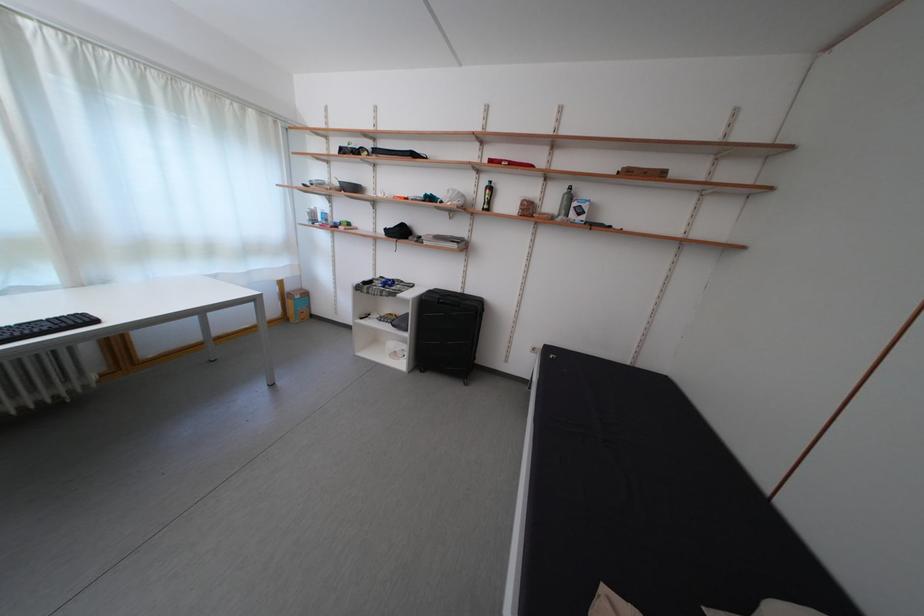
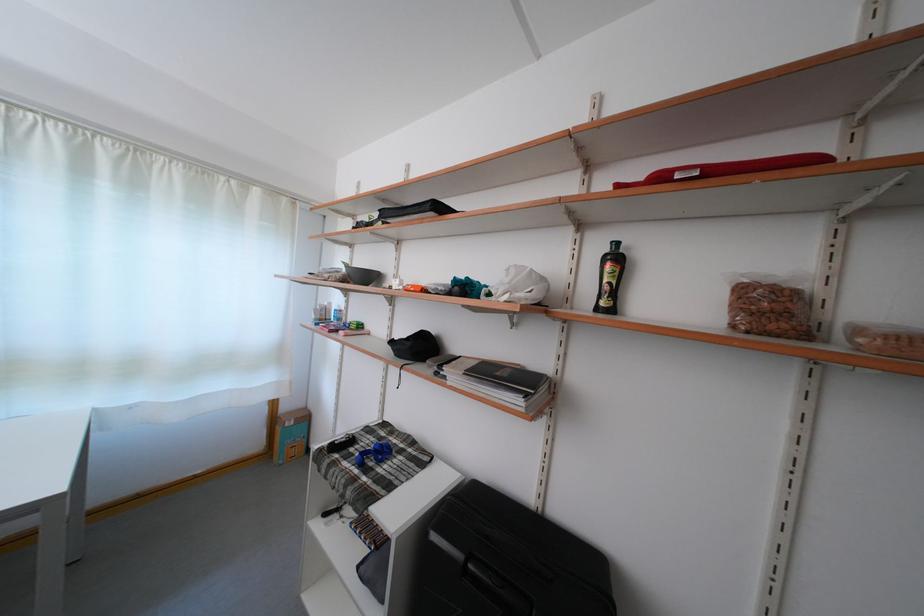
In the second image, find the point that corresponds to point 345,302 in the first image.

(344, 436)